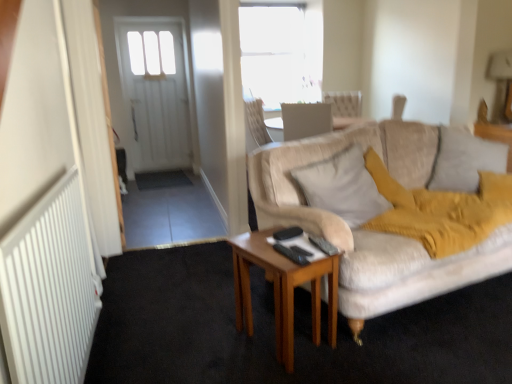
I want to click on free space to the left of black plastic remote control at center, which is the 1th remote control from front to back, so click(262, 253).